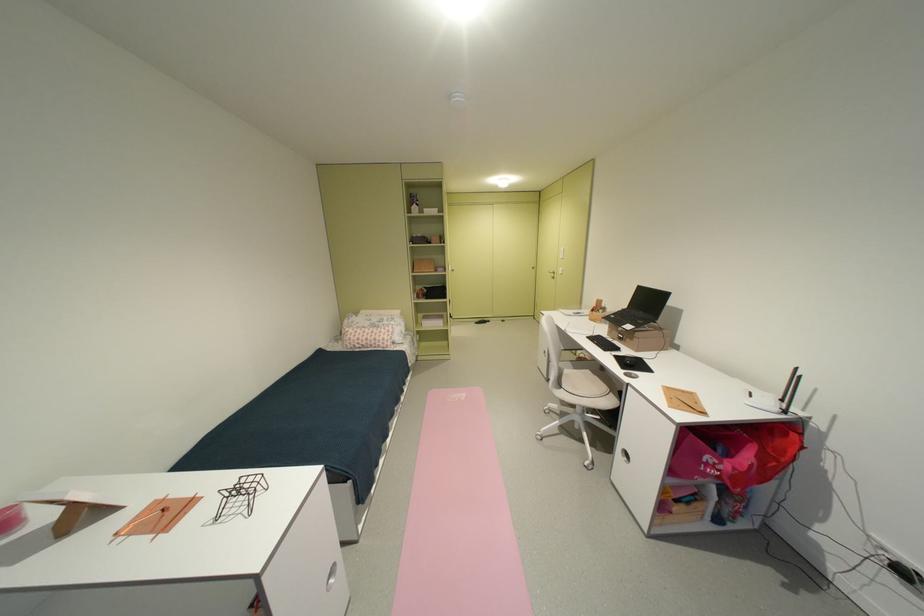
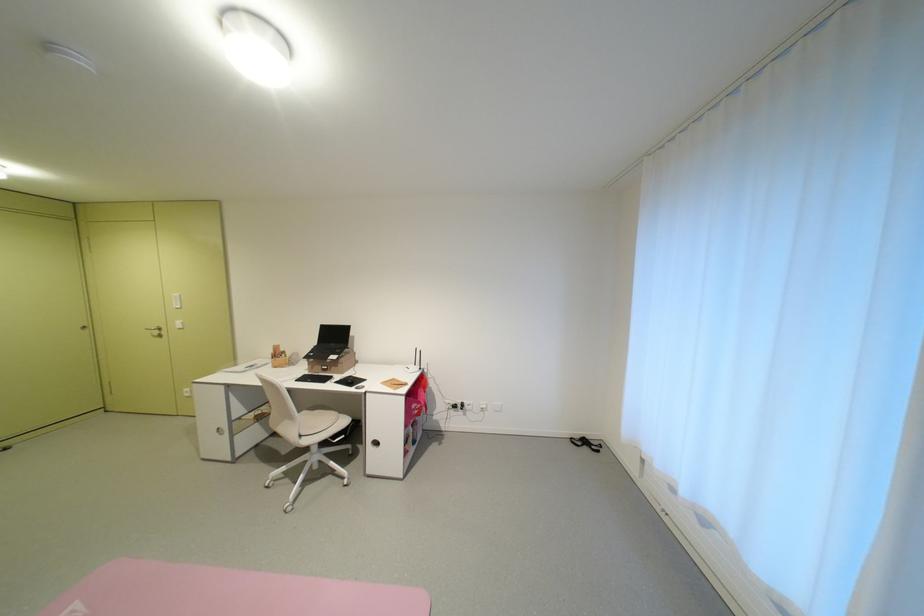
The point at (573, 387) is marked in the first image. Where is the corresponding point in the second image?

(311, 436)